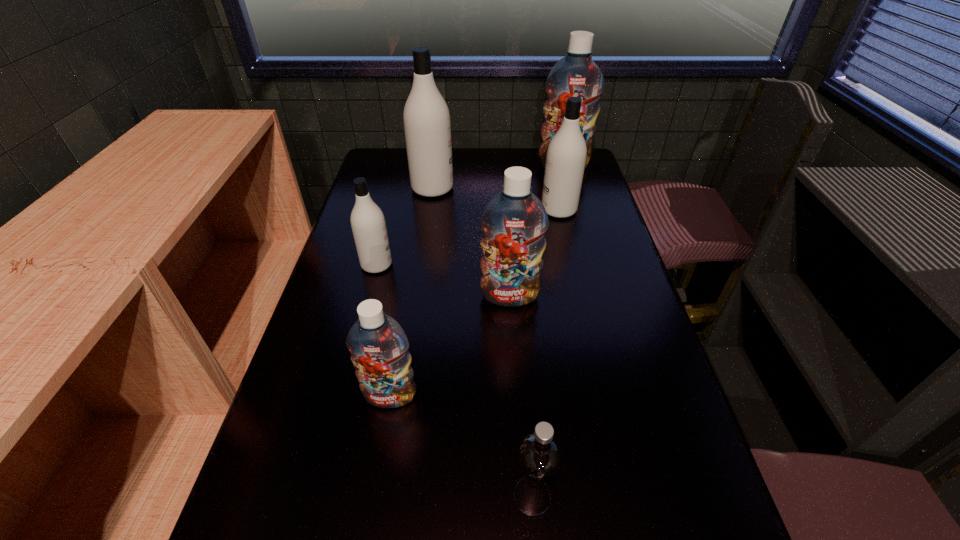
Locate an element on the screen. The image size is (960, 540). empty space that is in between the second nearest blue shampoo and the second white shampoo from right to left is located at coordinates pyautogui.click(x=471, y=242).

Find the location of a particular element. free spot between the second smallest blue shampoo and the third nearest shampoo is located at coordinates (444, 280).

Select which object appears as the closest to the nearest white shampoo. Please provide its 2D coordinates. Your answer should be formatted as a tuple, i.e. [(x, y)], where the tuple contains the x and y coordinates of a point satisfying the conditions above.

[(514, 222)]

Locate an element on the screen. object that is the second closest one to the second nearest blue shampoo is located at coordinates (378, 345).

This screenshot has height=540, width=960. I want to click on shampoo that is the fourth closest to the farthest shampoo, so click(x=368, y=223).

Where is `shampoo that is the second closest to the biggest blue shampoo`? shampoo that is the second closest to the biggest blue shampoo is located at coordinates (427, 125).

Where is `the closest white shampoo to the farthest object`? The height and width of the screenshot is (540, 960). the closest white shampoo to the farthest object is located at coordinates (566, 155).

Choose which white shampoo is the nearest neighbor to the smallest white shampoo. Please provide its 2D coordinates. Your answer should be formatted as a tuple, i.e. [(x, y)], where the tuple contains the x and y coordinates of a point satisfying the conditions above.

[(427, 125)]

Identify which blue shampoo is the third closest to the rightmost white shampoo. Please provide its 2D coordinates. Your answer should be formatted as a tuple, i.e. [(x, y)], where the tuple contains the x and y coordinates of a point satisfying the conditions above.

[(378, 345)]

Find the location of a particular element. This screenshot has height=540, width=960. blue shampoo that can be found as the third closest to the shortest object is located at coordinates (575, 75).